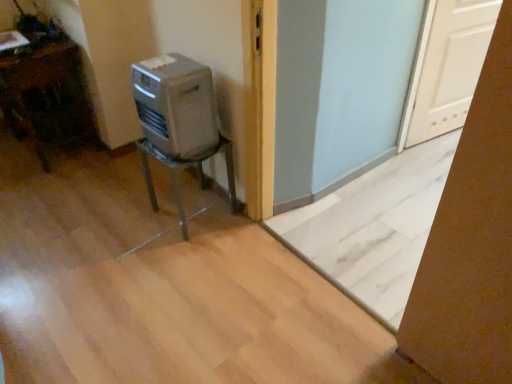
Question: Does brown cardboard box at lower right have a smaller size compared to white matte door at upper right?

Choices:
 (A) yes
 (B) no

Answer: (B)

Question: Does brown cardboard box at lower right have a lesser height compared to white matte door at upper right?

Choices:
 (A) no
 (B) yes

Answer: (A)

Question: Can you confirm if brown cardboard box at lower right is positioned to the left of white matte door at upper right?

Choices:
 (A) no
 (B) yes

Answer: (B)

Question: Is the surface of brown cardboard box at lower right in direct contact with white matte door at upper right?

Choices:
 (A) no
 (B) yes

Answer: (A)

Question: Can you confirm if brown cardboard box at lower right is thinner than white matte door at upper right?

Choices:
 (A) yes
 (B) no

Answer: (B)

Question: Is the depth of brown cardboard box at lower right greater than that of white matte door at upper right?

Choices:
 (A) no
 (B) yes

Answer: (A)

Question: From the image's perspective, is silver metallic heater at center on top of brown cardboard box at lower right?

Choices:
 (A) no
 (B) yes

Answer: (B)

Question: Considering the relative sizes of silver metallic heater at center and brown cardboard box at lower right in the image provided, is silver metallic heater at center thinner than brown cardboard box at lower right?

Choices:
 (A) yes
 (B) no

Answer: (B)

Question: From a real-world perspective, is silver metallic heater at center under brown cardboard box at lower right?

Choices:
 (A) yes
 (B) no

Answer: (B)

Question: Is silver metallic heater at center outside of brown cardboard box at lower right?

Choices:
 (A) no
 (B) yes

Answer: (B)

Question: Does silver metallic heater at center have a greater width compared to brown cardboard box at lower right?

Choices:
 (A) yes
 (B) no

Answer: (A)

Question: Does silver metallic heater at center appear on the left side of brown cardboard box at lower right?

Choices:
 (A) yes
 (B) no

Answer: (A)

Question: Is metallic gray chair at center-left, which appears as the 2th furniture when viewed from the left, a part of white matte door at upper right?

Choices:
 (A) yes
 (B) no

Answer: (B)